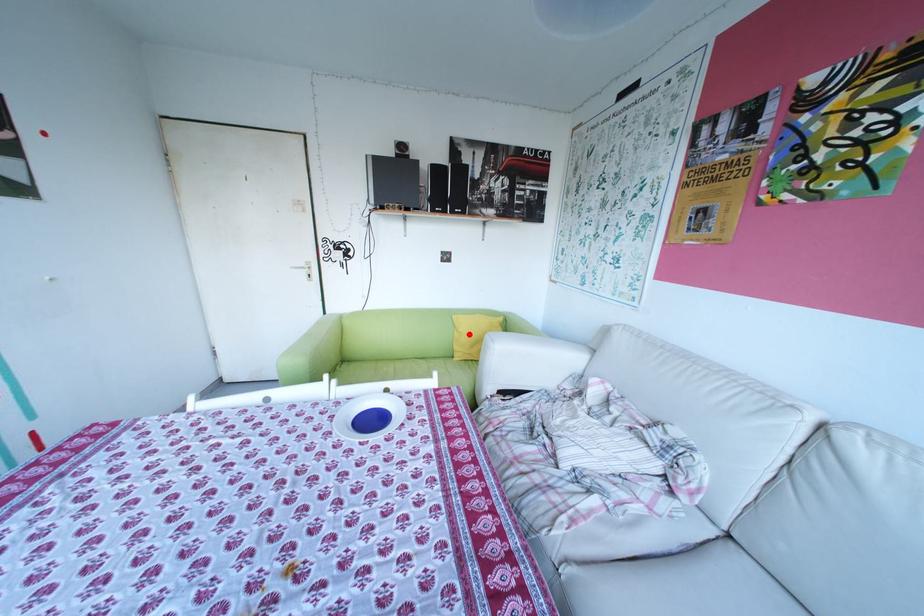
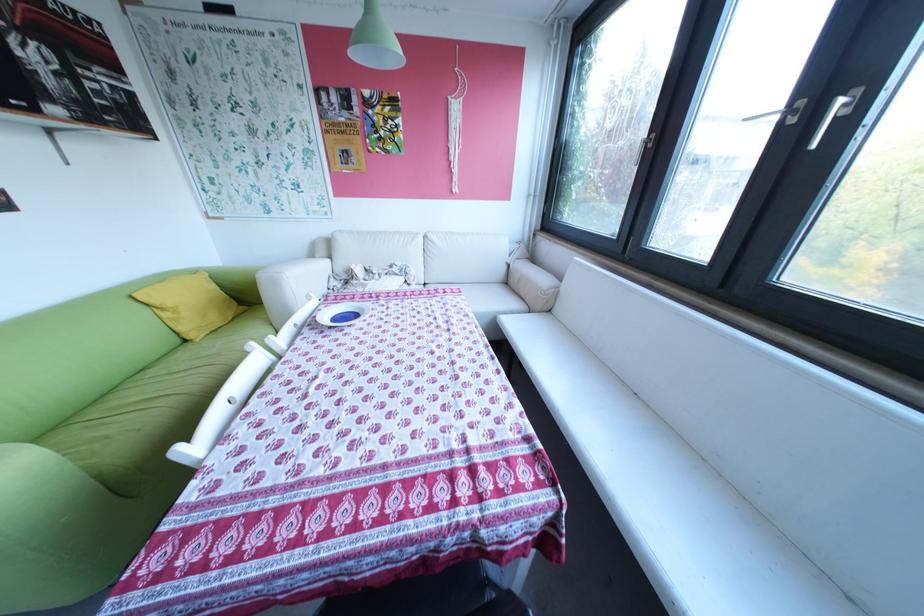
Question: A red point is marked in image1. In image2, is the corresponding 3D point closer to the camera or farther? Reply with the corresponding letter.

Choices:
 (A) The corresponding 3D point is closer.
 (B) The corresponding 3D point is farther.

Answer: (A)